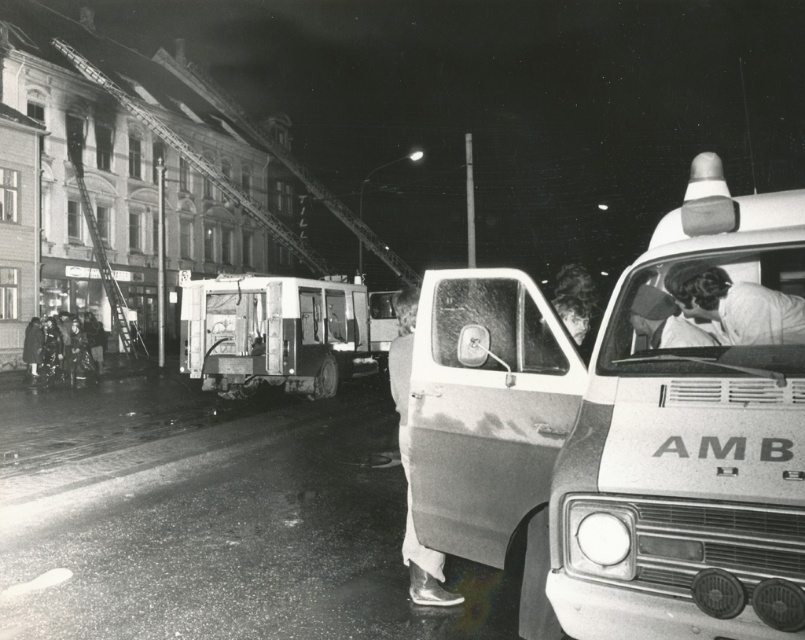
Question: Which object is farther from the camera taking this photo?

Choices:
 (A) white plastic ambulance at center
 (B) white matte uniform at center
 (C) metallic silver ambulance at center

Answer: (C)

Question: Is white matte uniform at center closer to the viewer compared to metallic silver shoe at lower center?

Choices:
 (A) no
 (B) yes

Answer: (B)

Question: Is white plastic ambulance at center bigger than metallic silver ambulance at center?

Choices:
 (A) no
 (B) yes

Answer: (A)

Question: Can you confirm if metallic silver ambulance at center is bigger than metallic silver shoe at lower center?

Choices:
 (A) yes
 (B) no

Answer: (A)

Question: Which point is closer to the camera?

Choices:
 (A) metallic silver ambulance at center
 (B) white plastic ambulance at center

Answer: (B)

Question: Which point is closer to the camera taking this photo?

Choices:
 (A) tap(409, 317)
 (B) tap(428, 474)
 (C) tap(688, 276)

Answer: (C)